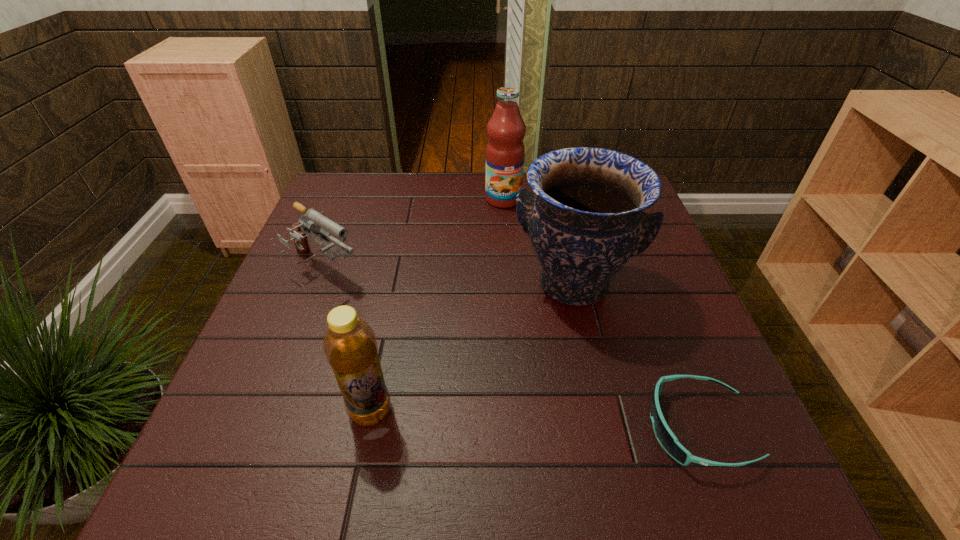
Where is `the second object from left to right`? The width and height of the screenshot is (960, 540). the second object from left to right is located at coordinates (350, 346).

This screenshot has width=960, height=540. In order to click on the shortest object in this screenshot , I will do `click(669, 442)`.

Identify the location of the farthest object. (505, 152).

At what (x,y) coordinates should I click in order to perform the action: click on the fourth tallest object. Please return your answer as a coordinate pair (x, y). This screenshot has width=960, height=540. Looking at the image, I should click on (316, 223).

Locate an element on the screen. the leftmost object is located at coordinates (316, 223).

At what (x,y) coordinates should I click in order to perform the action: click on pottery. Please return your answer as a coordinate pair (x, y). Looking at the image, I should click on (585, 221).

Find the location of a particular element. This screenshot has height=540, width=960. free space located on the right of the bottle is located at coordinates (483, 410).

Locate an element on the screen. The height and width of the screenshot is (540, 960). free space located on the front-facing side of the sunglasses is located at coordinates (510, 428).

The image size is (960, 540). I want to click on vacant area located on the front-facing side of the sunglasses, so click(587, 428).

Identify the location of free space located 0.300m on the front-facing side of the sunglasses. (482, 428).